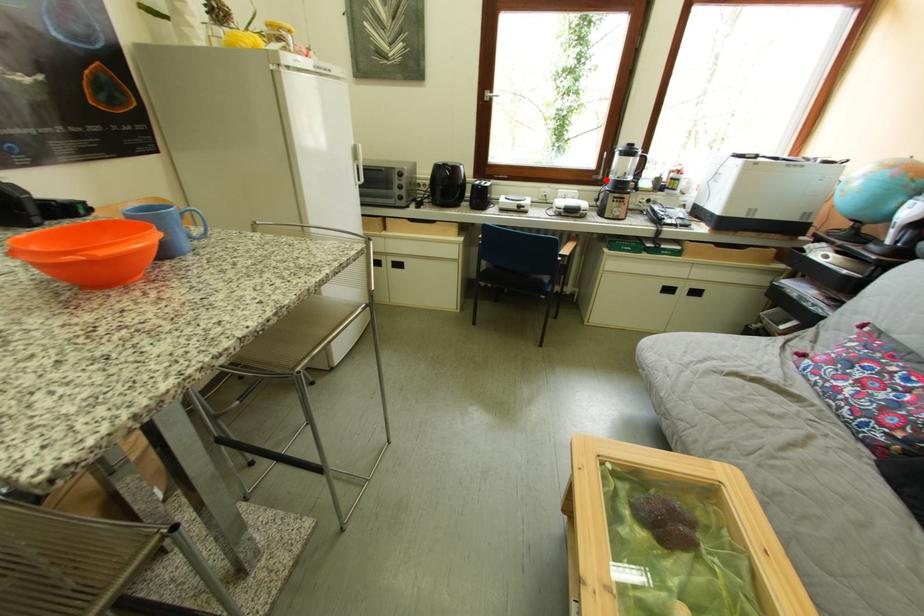
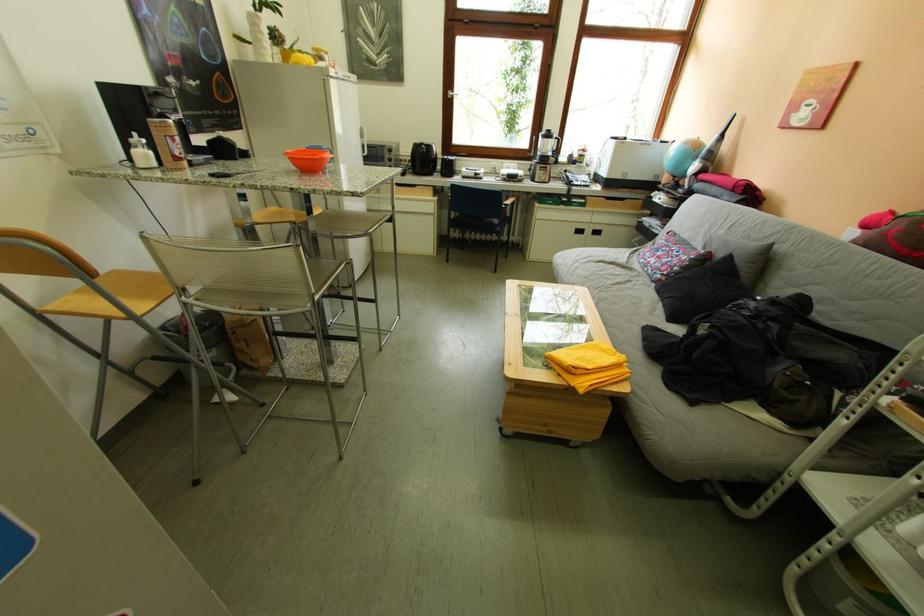
In the second image, find the point that corresponds to the highlighted location in the first image.

(541, 156)